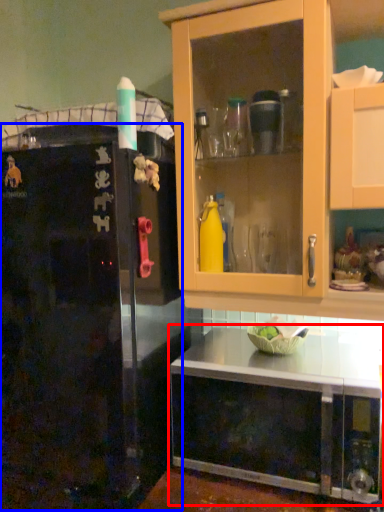
Question: Which object is closer to the camera taking this photo, cabinetry (highlighted by a red box) or refrigerator (highlighted by a blue box)?

Choices:
 (A) cabinetry
 (B) refrigerator

Answer: (B)